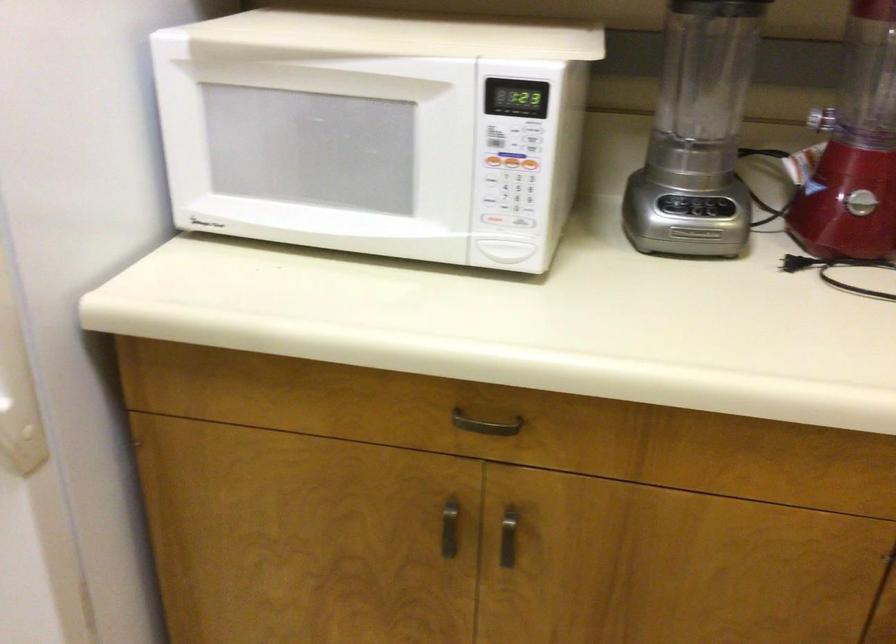
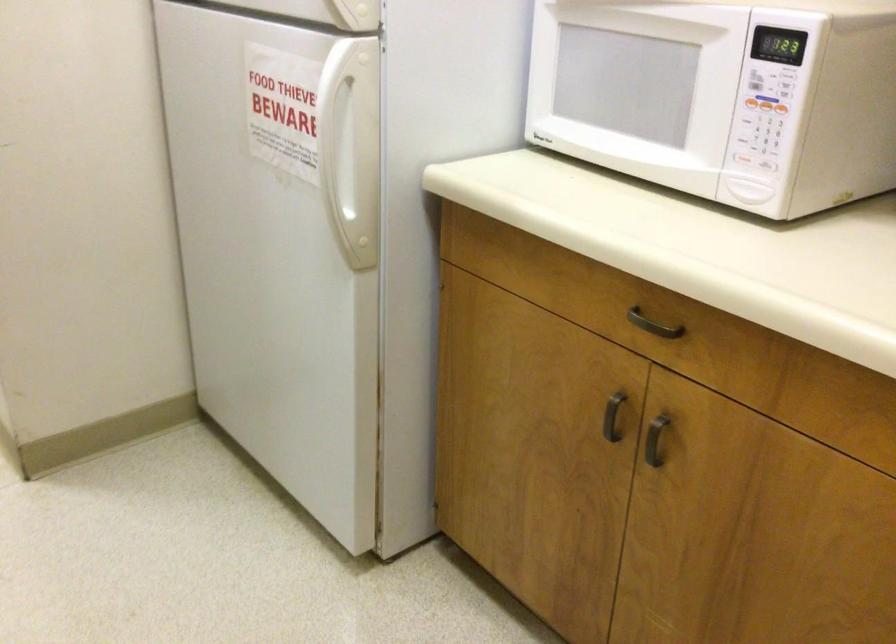
Where in the second image is the point corresponding to (x=510, y=545) from the first image?

(655, 440)